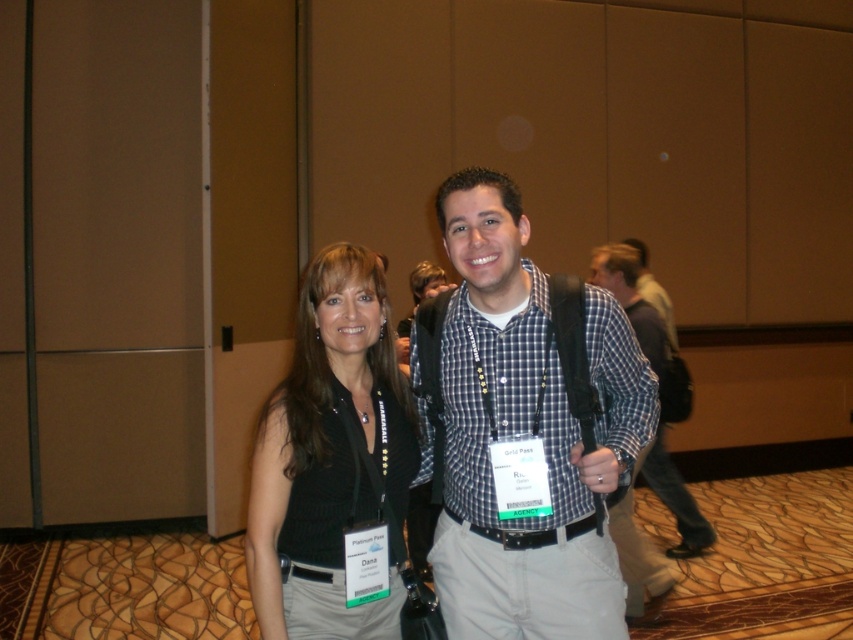
You are organizing a photo shoot and need to ensure that the checkered fabric shirt at center and the plaid fabric shirt at center fit side by side on a mannequin stand. Based on the image, can you determine if there will be enough space for both shirts without overlapping?

The checkered fabric shirt at center might be wider than plaid fabric shirt at center, so there may not be enough space for both shirts to fit side by side without overlapping on the mannequin stand.